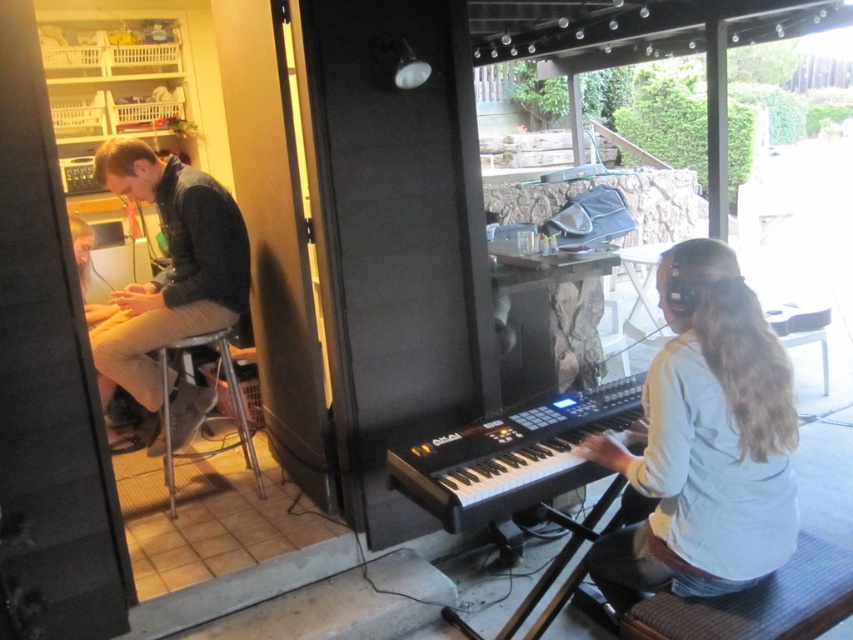
Between white matte shirt at right and black plastic keyboard at center, which one appears on the left side from the viewer's perspective?

black plastic keyboard at center is more to the left.

Does white matte shirt at right appear under black plastic keyboard at center?

Actually, white matte shirt at right is above black plastic keyboard at center.

The image size is (853, 640). What do you see at coordinates (704, 444) in the screenshot?
I see `white matte shirt at right` at bounding box center [704, 444].

The width and height of the screenshot is (853, 640). Identify the location of white matte shirt at right. (704, 444).

Does white matte shirt at right have a larger size compared to dark blue leather jacket at left?

No, white matte shirt at right is not bigger than dark blue leather jacket at left.

Which is behind, point (730, 394) or point (108, 173)?

Point (108, 173)

Identify the location of white matte shirt at right. (704, 444).

Is dark blue leather jacket at left thinner than metallic silver stool at lower left?

No.

Is dark blue leather jacket at left positioned at the back of metallic silver stool at lower left?

That is False.

Measure the distance between point (143, 307) and camera.

They are 9.57 feet apart.

This screenshot has width=853, height=640. I want to click on dark blue leather jacket at left, so click(x=170, y=266).